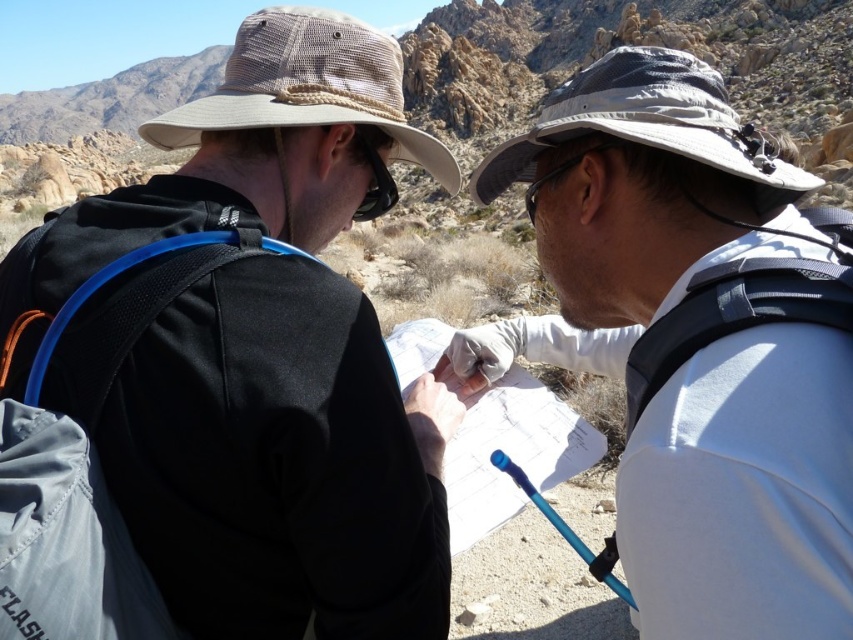
You are planning to take a photo of the black matte jacket at upper left and the white paper at center. Which object should you focus on first if you want to capture both in the frame without moving the camera?

The black matte jacket at upper left is wider than the white paper at center, so you should focus on the black matte jacket at upper left first to ensure it fits in the frame.